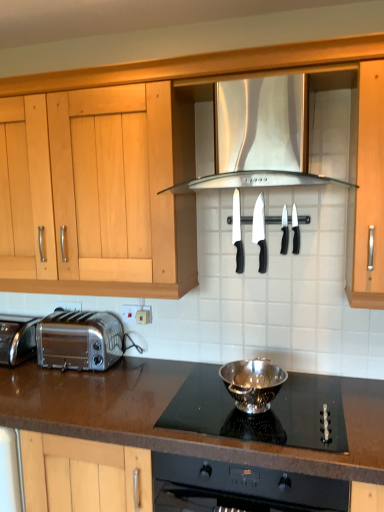
At what (x,y) coordinates should I click in order to perform the action: click on free space in front of satin chrome toaster at lower left. Please return your answer as a coordinate pair (x, y). The image size is (384, 512). Looking at the image, I should click on (20, 374).